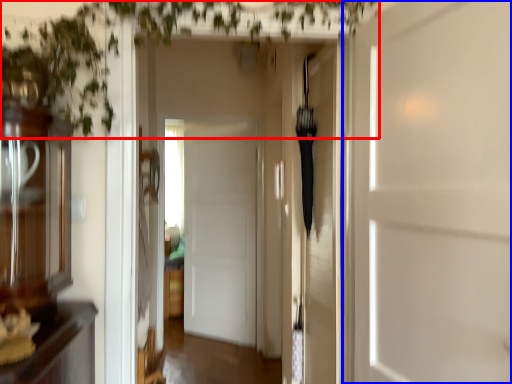
Question: Which object appears closest to the camera in this image, vegetation (highlighted by a red box) or door (highlighted by a blue box)?

Choices:
 (A) vegetation
 (B) door

Answer: (B)